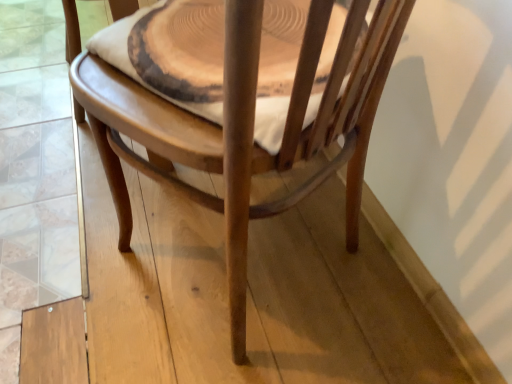
Question: Is wooden chair at center outside of wooden round table at center?

Choices:
 (A) yes
 (B) no

Answer: (A)

Question: Is wooden chair at center facing towards wooden round table at center?

Choices:
 (A) no
 (B) yes

Answer: (B)

Question: From the image's perspective, is wooden chair at center above wooden round table at center?

Choices:
 (A) yes
 (B) no

Answer: (B)

Question: Is the depth of wooden chair at center less than that of wooden round table at center?

Choices:
 (A) yes
 (B) no

Answer: (A)

Question: Does wooden chair at center have a greater height compared to wooden round table at center?

Choices:
 (A) no
 (B) yes

Answer: (B)

Question: From a real-world perspective, is wooden chair at center physically below wooden round table at center?

Choices:
 (A) no
 (B) yes

Answer: (B)

Question: Is wooden round table at center shorter than wooden chair at center?

Choices:
 (A) no
 (B) yes

Answer: (B)

Question: Considering the relative sizes of wooden round table at center and wooden chair at center in the image provided, is wooden round table at center smaller than wooden chair at center?

Choices:
 (A) no
 (B) yes

Answer: (B)

Question: Does wooden round table at center come in front of wooden chair at center?

Choices:
 (A) yes
 (B) no

Answer: (B)

Question: From a real-world perspective, is wooden round table at center positioned under wooden chair at center based on gravity?

Choices:
 (A) yes
 (B) no

Answer: (B)

Question: Is the surface of wooden round table at center in direct contact with wooden chair at center?

Choices:
 (A) no
 (B) yes

Answer: (A)

Question: From the image's perspective, is wooden round table at center over wooden chair at center?

Choices:
 (A) yes
 (B) no

Answer: (A)

Question: Is wooden round table at center in front of or behind wooden chair at center in the image?

Choices:
 (A) front
 (B) behind

Answer: (B)